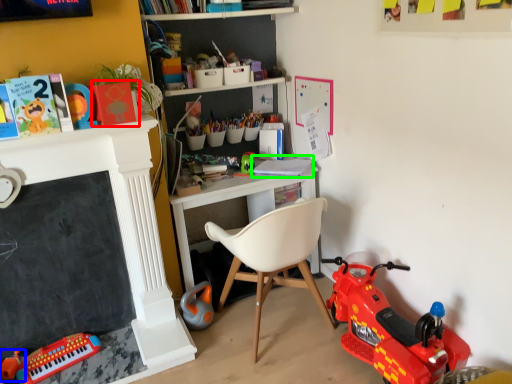
Question: Based on their relative distances, which object is farther from book (highlighted by a red box)? Choose from toy (highlighted by a blue box) and book (highlighted by a green box).

Choices:
 (A) toy
 (B) book

Answer: (A)